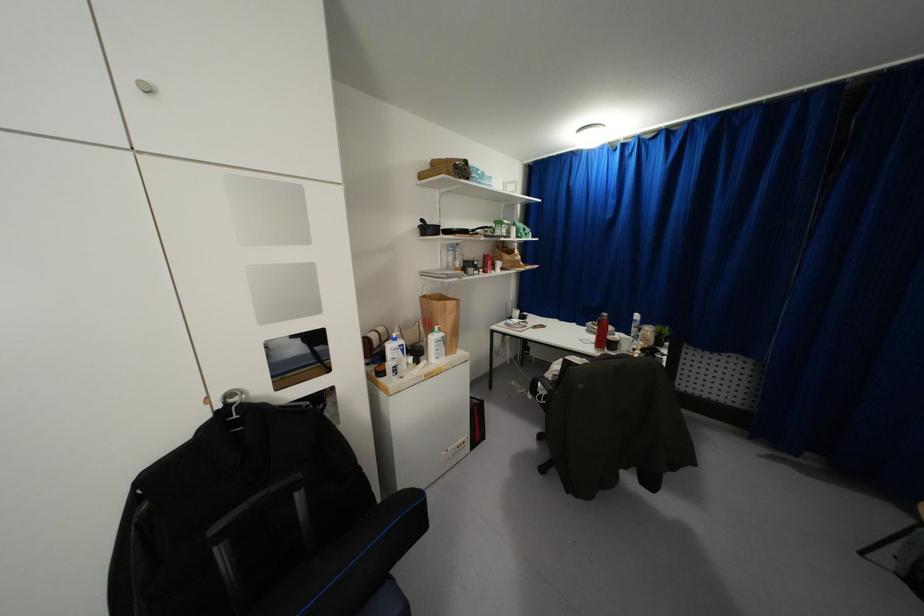
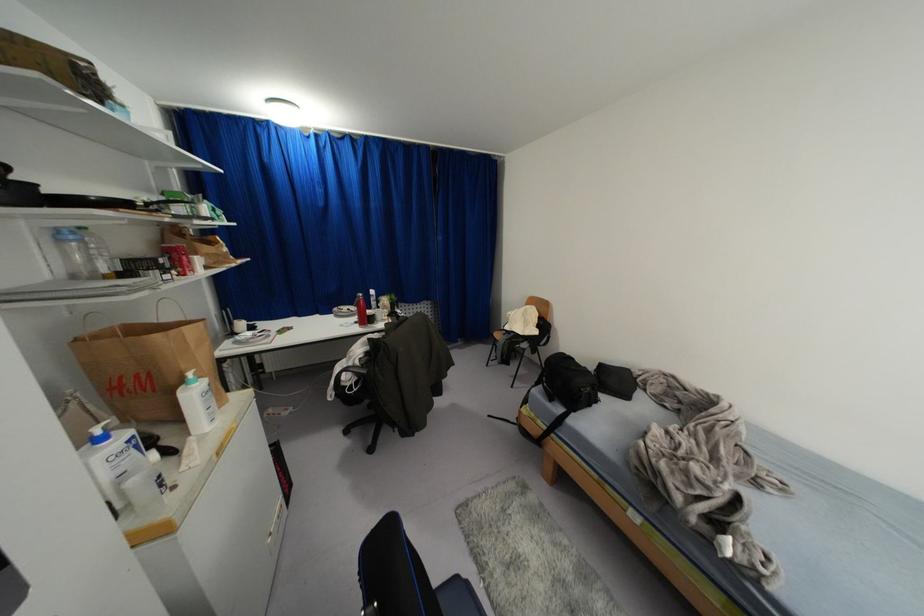
Locate, in the second image, the point that corresponds to pixel 394 334 in the first image.

(98, 431)